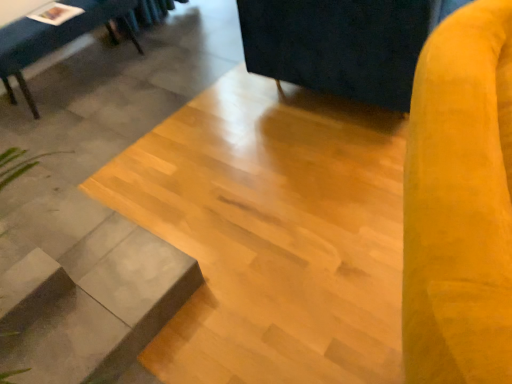
Question: Is gray concrete at lower left thinner than velvet yellow swivel chair at right, which is counted as the second swivel chair, starting from the bottom?

Choices:
 (A) no
 (B) yes

Answer: (B)

Question: From the image's perspective, is gray concrete at lower left beneath velvet yellow swivel chair at right, which is counted as the second swivel chair, starting from the bottom?

Choices:
 (A) no
 (B) yes

Answer: (B)

Question: From the image's perspective, is gray concrete at lower left on velvet yellow swivel chair at right, the 1th swivel chair viewed from the back?

Choices:
 (A) yes
 (B) no

Answer: (B)

Question: From a real-world perspective, is gray concrete at lower left positioned over velvet yellow swivel chair at right, the 1th swivel chair viewed from the back, based on gravity?

Choices:
 (A) yes
 (B) no

Answer: (B)

Question: Is gray concrete at lower left in front of velvet yellow swivel chair at right, the 1th swivel chair viewed from the back?

Choices:
 (A) no
 (B) yes

Answer: (B)

Question: Considering the positions of velvet yellow swivel chair at right, marked as the 1th swivel chair in a bottom-to-top arrangement, and gray concrete at lower left in the image, is velvet yellow swivel chair at right, marked as the 1th swivel chair in a bottom-to-top arrangement, wider or thinner than gray concrete at lower left?

Choices:
 (A) wide
 (B) thin

Answer: (B)

Question: From their relative heights in the image, would you say velvet yellow swivel chair at right, acting as the second swivel chair starting from the back, is taller or shorter than gray concrete at lower left?

Choices:
 (A) tall
 (B) short

Answer: (A)

Question: Relative to gray concrete at lower left, is velvet yellow swivel chair at right, which is the 2th swivel chair from top to bottom, in front or behind?

Choices:
 (A) front
 (B) behind

Answer: (A)

Question: Considering the positions of velvet yellow swivel chair at right, which is the 2th swivel chair from top to bottom, and gray concrete at lower left in the image, is velvet yellow swivel chair at right, which is the 2th swivel chair from top to bottom, bigger or smaller than gray concrete at lower left?

Choices:
 (A) big
 (B) small

Answer: (A)

Question: In terms of height, does velvet yellow swivel chair at right, which is counted as the second swivel chair, starting from the bottom, look taller or shorter compared to gray concrete at lower left?

Choices:
 (A) tall
 (B) short

Answer: (A)

Question: In terms of width, does velvet yellow swivel chair at right, the 1th swivel chair viewed from the back, look wider or thinner when compared to gray concrete at lower left?

Choices:
 (A) wide
 (B) thin

Answer: (A)

Question: Relative to gray concrete at lower left, is velvet yellow swivel chair at right, arranged as the first swivel chair when viewed from the top, in front or behind?

Choices:
 (A) front
 (B) behind

Answer: (B)

Question: From the image's perspective, is velvet yellow swivel chair at right, which is counted as the 2th swivel chair, starting from the front, located above or below gray concrete at lower left?

Choices:
 (A) above
 (B) below

Answer: (A)

Question: Considering the positions of gray concrete at lower left and velvet yellow swivel chair at right, which is the 2th swivel chair from top to bottom, in the image, is gray concrete at lower left bigger or smaller than velvet yellow swivel chair at right, which is the 2th swivel chair from top to bottom,?

Choices:
 (A) big
 (B) small

Answer: (B)

Question: Considering the positions of gray concrete at lower left and velvet yellow swivel chair at right, marked as the 1th swivel chair in a bottom-to-top arrangement, in the image, is gray concrete at lower left taller or shorter than velvet yellow swivel chair at right, marked as the 1th swivel chair in a bottom-to-top arrangement,?

Choices:
 (A) short
 (B) tall

Answer: (A)